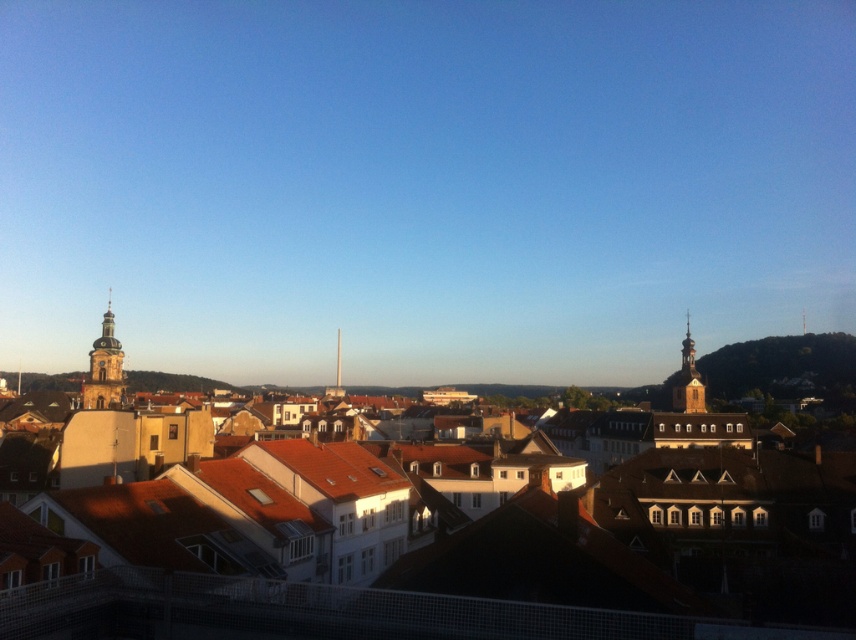
Question: Is brown clay roof tiles at center bigger than gold ornate tower at right?

Choices:
 (A) yes
 (B) no

Answer: (A)

Question: Which object appears closest to the camera in this image?

Choices:
 (A) brown clay roof tiles at center
 (B) golden stone tower at left
 (C) gold ornate tower at right

Answer: (A)

Question: Which point is closer to the camera?

Choices:
 (A) (116, 339)
 (B) (685, 403)

Answer: (A)

Question: Is brown clay roof tiles at center positioned behind golden stone tower at left?

Choices:
 (A) no
 (B) yes

Answer: (A)

Question: Can you confirm if golden stone tower at left is positioned below gold ornate tower at right?

Choices:
 (A) yes
 (B) no

Answer: (B)

Question: Which point appears farthest from the camera in this image?

Choices:
 (A) (275, 632)
 (B) (111, 376)
 (C) (690, 340)

Answer: (C)